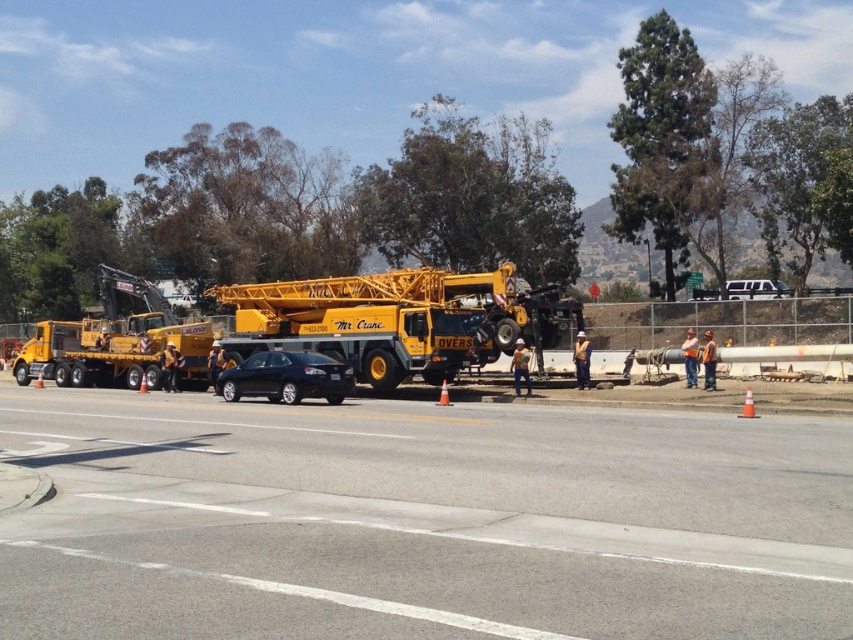
Question: Which point is closer to the camera taking this photo?

Choices:
 (A) (399, 320)
 (B) (827, 595)

Answer: (B)

Question: Is asphalt at center closer to the viewer compared to yellow metallic crane at center?

Choices:
 (A) no
 (B) yes

Answer: (B)

Question: In this image, where is asphalt at center located relative to yellow metallic crane at center?

Choices:
 (A) below
 (B) above

Answer: (A)

Question: In this image, where is asphalt at center located relative to yellow metallic crane at center?

Choices:
 (A) below
 (B) above

Answer: (A)